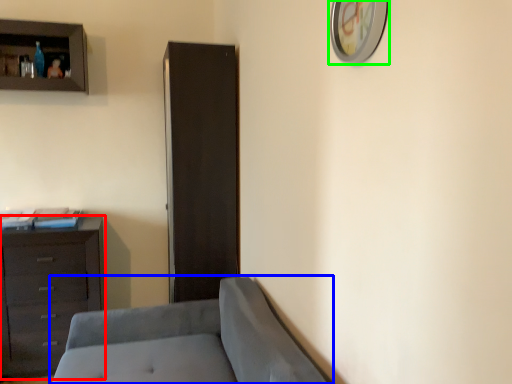
Question: Estimate the real-world distances between objects in this image. Which object is farther from chest of drawers (highlighted by a red box), studio couch (highlighted by a blue box) or picture frame (highlighted by a green box)?

Choices:
 (A) studio couch
 (B) picture frame

Answer: (B)